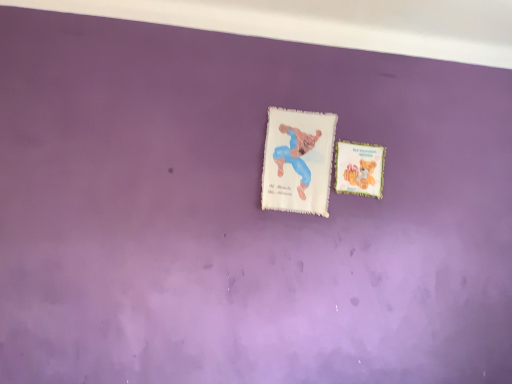
Identify the location of white fluffy postcard at center, which appears as the 1th postcard when viewed from the left. This screenshot has height=384, width=512. (298, 161).

What do you see at coordinates (298, 161) in the screenshot? I see `white fluffy postcard at center, which appears as the 1th postcard when viewed from the left` at bounding box center [298, 161].

Identify the location of matte paper postcard at upper right, marked as the 1th postcard in a right-to-left arrangement. (359, 168).

What do you see at coordinates (359, 168) in the screenshot?
I see `matte paper postcard at upper right, marked as the 1th postcard in a right-to-left arrangement` at bounding box center [359, 168].

How much space does matte paper postcard at upper right, which is the 2th postcard from left to right, occupy horizontally?

0.63 inches.

The height and width of the screenshot is (384, 512). Find the location of `white fluffy postcard at center, which is the 2th postcard from right to left`. white fluffy postcard at center, which is the 2th postcard from right to left is located at coordinates (298, 161).

Considering the positions of objects white fluffy postcard at center, which is the 2th postcard from right to left, and matte paper postcard at upper right, marked as the 1th postcard in a right-to-left arrangement, in the image provided, who is more to the left, white fluffy postcard at center, which is the 2th postcard from right to left, or matte paper postcard at upper right, marked as the 1th postcard in a right-to-left arrangement,?

From the viewer's perspective, white fluffy postcard at center, which is the 2th postcard from right to left, appears more on the left side.

Is white fluffy postcard at center, which is the 2th postcard from right to left, closer to the viewer compared to matte paper postcard at upper right, marked as the 1th postcard in a right-to-left arrangement?

Yes, it is.

Which point is more distant from viewer, (x=322, y=210) or (x=364, y=145)?

The point (x=364, y=145) is farther.

From the image's perspective, is white fluffy postcard at center, which is the 2th postcard from right to left, on top of matte paper postcard at upper right, marked as the 1th postcard in a right-to-left arrangement?

Yes, from the image's perspective, white fluffy postcard at center, which is the 2th postcard from right to left, is on top of matte paper postcard at upper right, marked as the 1th postcard in a right-to-left arrangement.

From a real-world perspective, which is physically below, white fluffy postcard at center, which appears as the 1th postcard when viewed from the left, or matte paper postcard at upper right, marked as the 1th postcard in a right-to-left arrangement?

white fluffy postcard at center, which appears as the 1th postcard when viewed from the left, is physically lower.

Is white fluffy postcard at center, which appears as the 1th postcard when viewed from the left, wider or thinner than matte paper postcard at upper right, marked as the 1th postcard in a right-to-left arrangement?

Considering their sizes, white fluffy postcard at center, which appears as the 1th postcard when viewed from the left, looks broader than matte paper postcard at upper right, marked as the 1th postcard in a right-to-left arrangement.

Considering the relative sizes of white fluffy postcard at center, which is the 2th postcard from right to left, and matte paper postcard at upper right, marked as the 1th postcard in a right-to-left arrangement, in the image provided, is white fluffy postcard at center, which is the 2th postcard from right to left, shorter than matte paper postcard at upper right, marked as the 1th postcard in a right-to-left arrangement,?

In fact, white fluffy postcard at center, which is the 2th postcard from right to left, may be taller than matte paper postcard at upper right, marked as the 1th postcard in a right-to-left arrangement.

Can you confirm if white fluffy postcard at center, which appears as the 1th postcard when viewed from the left, is bigger than matte paper postcard at upper right, marked as the 1th postcard in a right-to-left arrangement?

Indeed, white fluffy postcard at center, which appears as the 1th postcard when viewed from the left, has a larger size compared to matte paper postcard at upper right, marked as the 1th postcard in a right-to-left arrangement.

Is white fluffy postcard at center, which is the 2th postcard from right to left, inside the boundaries of matte paper postcard at upper right, marked as the 1th postcard in a right-to-left arrangement, or outside?

white fluffy postcard at center, which is the 2th postcard from right to left, cannot be found inside matte paper postcard at upper right, marked as the 1th postcard in a right-to-left arrangement.

From the picture: Is white fluffy postcard at center, which appears as the 1th postcard when viewed from the left, far from matte paper postcard at upper right, marked as the 1th postcard in a right-to-left arrangement?

No, white fluffy postcard at center, which appears as the 1th postcard when viewed from the left, is not far away from matte paper postcard at upper right, marked as the 1th postcard in a right-to-left arrangement.

Is white fluffy postcard at center, which appears as the 1th postcard when viewed from the left, turned away from matte paper postcard at upper right, which is the 2th postcard from left to right?

No, matte paper postcard at upper right, which is the 2th postcard from left to right, is not at the back of white fluffy postcard at center, which appears as the 1th postcard when viewed from the left.

Based on the photo, can you tell me how much white fluffy postcard at center, which is the 2th postcard from right to left, and matte paper postcard at upper right, marked as the 1th postcard in a right-to-left arrangement, differ in facing direction?

0.19 degrees separate the facing orientations of white fluffy postcard at center, which is the 2th postcard from right to left, and matte paper postcard at upper right, marked as the 1th postcard in a right-to-left arrangement.

Identify the location of postcard below the matte paper postcard at upper right, marked as the 1th postcard in a right-to-left arrangement (from a real-world perspective). This screenshot has height=384, width=512. (298, 161).

Considering the positions of objects matte paper postcard at upper right, marked as the 1th postcard in a right-to-left arrangement, and white fluffy postcard at center, which is the 2th postcard from right to left, in the image provided, who is more to the right, matte paper postcard at upper right, marked as the 1th postcard in a right-to-left arrangement, or white fluffy postcard at center, which is the 2th postcard from right to left,?

Positioned to the right is matte paper postcard at upper right, marked as the 1th postcard in a right-to-left arrangement.

Considering their positions, is matte paper postcard at upper right, marked as the 1th postcard in a right-to-left arrangement, located in front of or behind white fluffy postcard at center, which appears as the 1th postcard when viewed from the left?

In the image, matte paper postcard at upper right, marked as the 1th postcard in a right-to-left arrangement, appears behind white fluffy postcard at center, which appears as the 1th postcard when viewed from the left.

Between point (381, 148) and point (316, 152), which one is positioned behind?

Positioned behind is point (381, 148).

From the image's perspective, who appears lower, matte paper postcard at upper right, marked as the 1th postcard in a right-to-left arrangement, or white fluffy postcard at center, which is the 2th postcard from right to left?

matte paper postcard at upper right, marked as the 1th postcard in a right-to-left arrangement.

From a real-world perspective, which object stands above the other?

In real-world perspective, matte paper postcard at upper right, which is the 2th postcard from left to right, is above.

From the picture: Looking at their sizes, would you say matte paper postcard at upper right, which is the 2th postcard from left to right, is wider or thinner than white fluffy postcard at center, which appears as the 1th postcard when viewed from the left?

Clearly, matte paper postcard at upper right, which is the 2th postcard from left to right, has less width compared to white fluffy postcard at center, which appears as the 1th postcard when viewed from the left.

Which of these two, matte paper postcard at upper right, marked as the 1th postcard in a right-to-left arrangement, or white fluffy postcard at center, which is the 2th postcard from right to left, stands shorter?

matte paper postcard at upper right, marked as the 1th postcard in a right-to-left arrangement.

Based on their sizes in the image, would you say matte paper postcard at upper right, marked as the 1th postcard in a right-to-left arrangement, is bigger or smaller than white fluffy postcard at center, which appears as the 1th postcard when viewed from the left?

In the image, matte paper postcard at upper right, marked as the 1th postcard in a right-to-left arrangement, appears to be smaller than white fluffy postcard at center, which appears as the 1th postcard when viewed from the left.

Is matte paper postcard at upper right, marked as the 1th postcard in a right-to-left arrangement, not within white fluffy postcard at center, which appears as the 1th postcard when viewed from the left?

matte paper postcard at upper right, marked as the 1th postcard in a right-to-left arrangement, is positioned outside white fluffy postcard at center, which appears as the 1th postcard when viewed from the left.

In the scene shown: Is matte paper postcard at upper right, marked as the 1th postcard in a right-to-left arrangement, positioned far away from white fluffy postcard at center, which appears as the 1th postcard when viewed from the left?

Actually, matte paper postcard at upper right, marked as the 1th postcard in a right-to-left arrangement, and white fluffy postcard at center, which appears as the 1th postcard when viewed from the left, are a little close together.

Is matte paper postcard at upper right, which is the 2th postcard from left to right, oriented towards white fluffy postcard at center, which is the 2th postcard from right to left?

No, matte paper postcard at upper right, which is the 2th postcard from left to right, is not aimed at white fluffy postcard at center, which is the 2th postcard from right to left.

How different are the orientations of matte paper postcard at upper right, marked as the 1th postcard in a right-to-left arrangement, and white fluffy postcard at center, which appears as the 1th postcard when viewed from the left, in degrees?

The facing directions of matte paper postcard at upper right, marked as the 1th postcard in a right-to-left arrangement, and white fluffy postcard at center, which appears as the 1th postcard when viewed from the left, are 0.19 degrees apart.

Identify the location of postcard on the right of white fluffy postcard at center, which is the 2th postcard from right to left. Image resolution: width=512 pixels, height=384 pixels. 359,168.

Identify the location of postcard that appears on the right of white fluffy postcard at center, which appears as the 1th postcard when viewed from the left. The width and height of the screenshot is (512, 384). (359, 168).

The image size is (512, 384). Find the location of `postcard above the white fluffy postcard at center, which appears as the 1th postcard when viewed from the left (from a real-world perspective)`. postcard above the white fluffy postcard at center, which appears as the 1th postcard when viewed from the left (from a real-world perspective) is located at coordinates (359, 168).